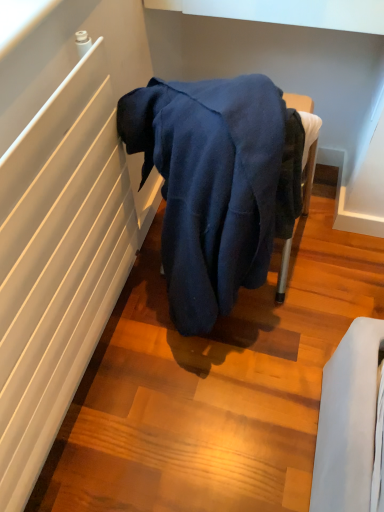
Describe the element at coordinates (58, 261) in the screenshot. I see `white smooth radiator at left` at that location.

Locate an element on the screen. This screenshot has width=384, height=512. white smooth radiator at left is located at coordinates (58, 261).

Locate an element on the screen. The image size is (384, 512). white smooth radiator at left is located at coordinates (58, 261).